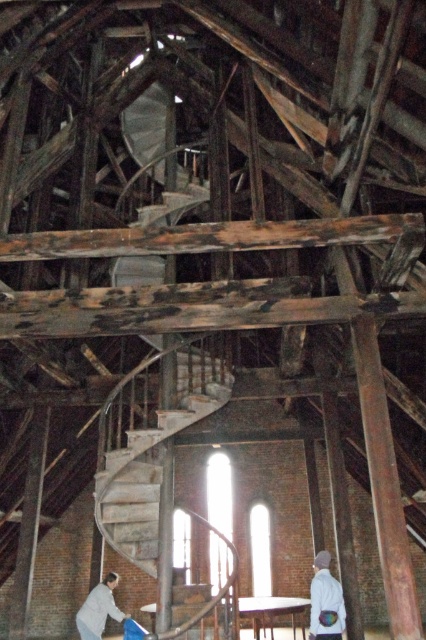
Question: Is white matte jacket at lower right wider than light gray fabric at lower left?

Choices:
 (A) no
 (B) yes

Answer: (A)

Question: Does white matte jacket at lower right appear on the left side of light gray fabric at lower left?

Choices:
 (A) no
 (B) yes

Answer: (A)

Question: Which of the following is the closest to the observer?

Choices:
 (A) (92, 627)
 (B) (339, 628)

Answer: (B)

Question: Among these objects, which one is farthest from the camera?

Choices:
 (A) light gray fabric at lower left
 (B) white matte jacket at lower right

Answer: (A)

Question: Which object appears closest to the camera in this image?

Choices:
 (A) white matte jacket at lower right
 (B) light gray fabric at lower left

Answer: (A)

Question: Is white matte jacket at lower right bigger than light gray fabric at lower left?

Choices:
 (A) no
 (B) yes

Answer: (A)